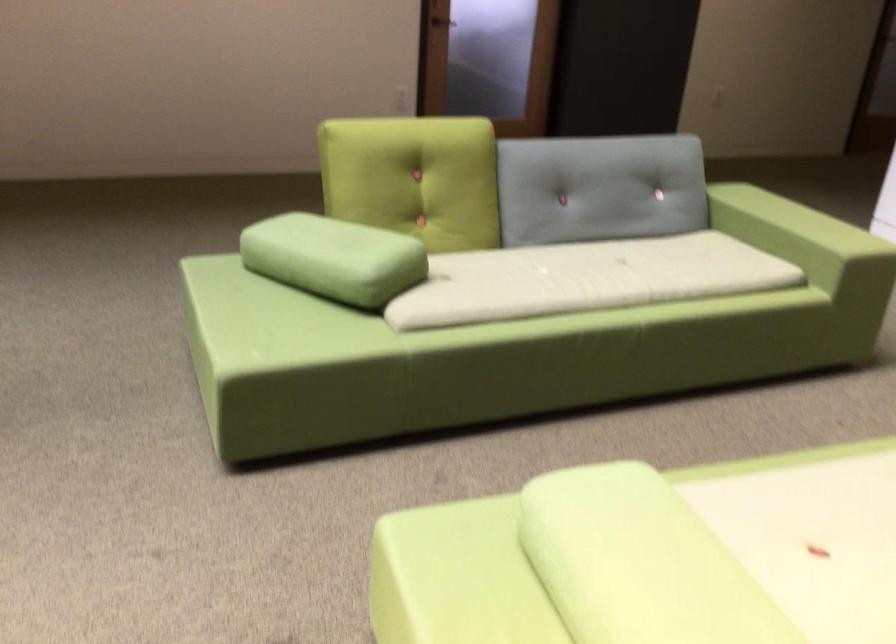
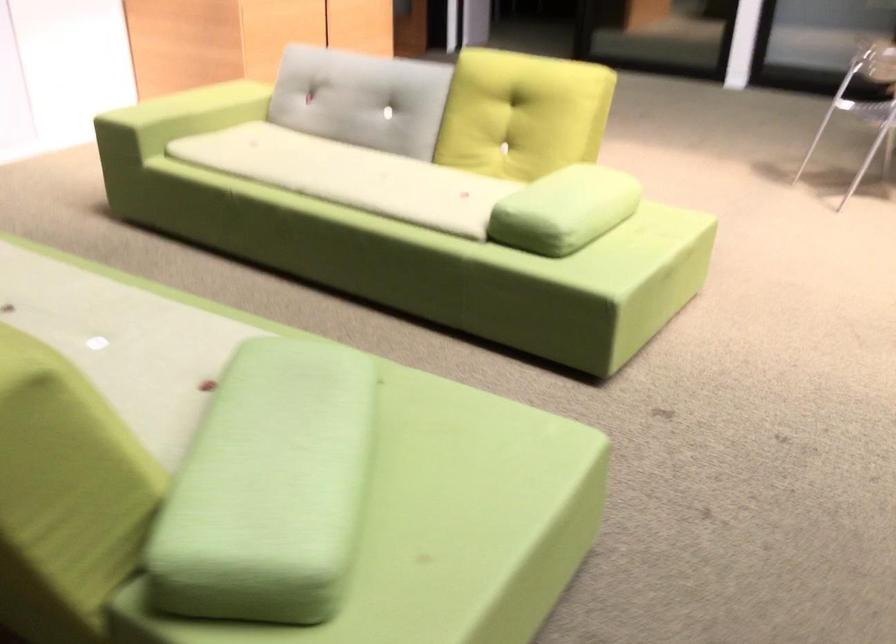
Where in the second image is the point corresponding to pixel 554 491 from the first image?

(564, 210)